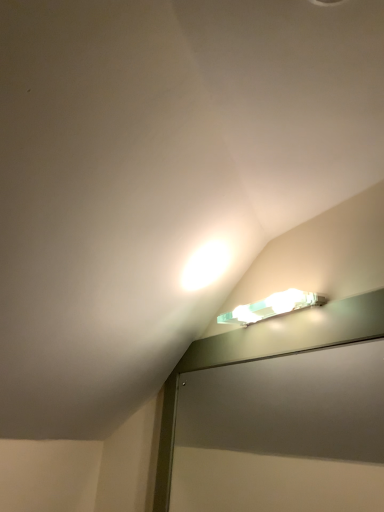
The height and width of the screenshot is (512, 384). What are the coordinates of `translucent plastic light fixture at upper right` in the screenshot? It's located at (271, 307).

This screenshot has width=384, height=512. What do you see at coordinates (271, 307) in the screenshot? I see `translucent plastic light fixture at upper right` at bounding box center [271, 307].

Describe the element at coordinates (283, 434) in the screenshot. I see `clear glass screen door at upper center` at that location.

Identify the location of clear glass screen door at upper center. (283, 434).

Find the location of `translucent plastic light fixture at upper right`. translucent plastic light fixture at upper right is located at coordinates (271, 307).

Between clear glass screen door at upper center and translucent plastic light fixture at upper right, which one appears on the left side from the viewer's perspective?

clear glass screen door at upper center is more to the left.

From the picture: Considering the relative positions of clear glass screen door at upper center and translucent plastic light fixture at upper right in the image provided, is clear glass screen door at upper center behind translucent plastic light fixture at upper right?

No, clear glass screen door at upper center is closer to the camera.

Considering the positions of point (328, 394) and point (248, 320), is point (328, 394) closer or farther from the camera than point (248, 320)?

Point (328, 394) is farther from the camera than point (248, 320).

From the image's perspective, would you say clear glass screen door at upper center is shown under translucent plastic light fixture at upper right?

Yes, from the image's perspective, clear glass screen door at upper center is below translucent plastic light fixture at upper right.

From a real-world perspective, is clear glass screen door at upper center above or below translucent plastic light fixture at upper right?

From a real-world perspective, clear glass screen door at upper center is physically below translucent plastic light fixture at upper right.

Which object is thinner, clear glass screen door at upper center or translucent plastic light fixture at upper right?

clear glass screen door at upper center.

In terms of height, does clear glass screen door at upper center look taller or shorter compared to translucent plastic light fixture at upper right?

Clearly, clear glass screen door at upper center is taller compared to translucent plastic light fixture at upper right.

Considering the sizes of objects clear glass screen door at upper center and translucent plastic light fixture at upper right in the image provided, who is bigger, clear glass screen door at upper center or translucent plastic light fixture at upper right?

With larger size is clear glass screen door at upper center.

In the scene shown: Could translucent plastic light fixture at upper right be considered to be inside clear glass screen door at upper center?

That's incorrect, translucent plastic light fixture at upper right is not inside clear glass screen door at upper center.

Is clear glass screen door at upper center placed right next to translucent plastic light fixture at upper right?

No, clear glass screen door at upper center is not with translucent plastic light fixture at upper right.

Looking at this image, could you tell me if clear glass screen door at upper center is turned towards translucent plastic light fixture at upper right?

No, clear glass screen door at upper center is not turned towards translucent plastic light fixture at upper right.

Measure the distance from clear glass screen door at upper center to translucent plastic light fixture at upper right.

clear glass screen door at upper center is 56.82 centimeters from translucent plastic light fixture at upper right.

Identify the location of lamp on the right of clear glass screen door at upper center. Image resolution: width=384 pixels, height=512 pixels. (271, 307).

Considering the positions of objects translucent plastic light fixture at upper right and clear glass screen door at upper center in the image provided, who is more to the left, translucent plastic light fixture at upper right or clear glass screen door at upper center?

clear glass screen door at upper center is more to the left.

Does translucent plastic light fixture at upper right lie behind clear glass screen door at upper center?

Yes, it is behind clear glass screen door at upper center.

Considering the points (224, 316) and (354, 460), which point is in front, point (224, 316) or point (354, 460)?

The point (224, 316) is closer.

From the image's perspective, would you say translucent plastic light fixture at upper right is positioned over clear glass screen door at upper center?

Yes, from the image's perspective, translucent plastic light fixture at upper right is over clear glass screen door at upper center.

From a real-world perspective, is translucent plastic light fixture at upper right physically located above or below clear glass screen door at upper center?

translucent plastic light fixture at upper right is situated higher than clear glass screen door at upper center in the real world.

From the picture: Considering the relative sizes of translucent plastic light fixture at upper right and clear glass screen door at upper center in the image provided, is translucent plastic light fixture at upper right thinner than clear glass screen door at upper center?

No.

Considering the relative sizes of translucent plastic light fixture at upper right and clear glass screen door at upper center in the image provided, is translucent plastic light fixture at upper right taller than clear glass screen door at upper center?

Incorrect, the height of translucent plastic light fixture at upper right is not larger of that of clear glass screen door at upper center.

Considering the relative sizes of translucent plastic light fixture at upper right and clear glass screen door at upper center in the image provided, is translucent plastic light fixture at upper right bigger than clear glass screen door at upper center?

No.

Do you think translucent plastic light fixture at upper right is within clear glass screen door at upper center, or outside of it?

translucent plastic light fixture at upper right is not enclosed by clear glass screen door at upper center.

Are translucent plastic light fixture at upper right and clear glass screen door at upper center beside each other?

translucent plastic light fixture at upper right and clear glass screen door at upper center are not in contact.

Consider the image. Is translucent plastic light fixture at upper right oriented away from clear glass screen door at upper center?

No.

Can you tell me how much translucent plastic light fixture at upper right and clear glass screen door at upper center differ in facing direction?

The facing directions of translucent plastic light fixture at upper right and clear glass screen door at upper center are 0.00242 degrees apart.

What are the coordinates of `screen door to the left of translucent plastic light fixture at upper right` in the screenshot? It's located at (283, 434).

Find the location of a particular element. lamp above the clear glass screen door at upper center (from a real-world perspective) is located at coordinates (271, 307).

What are the coordinates of `screen door below the translucent plastic light fixture at upper right (from a real-world perspective)` in the screenshot? It's located at (283, 434).